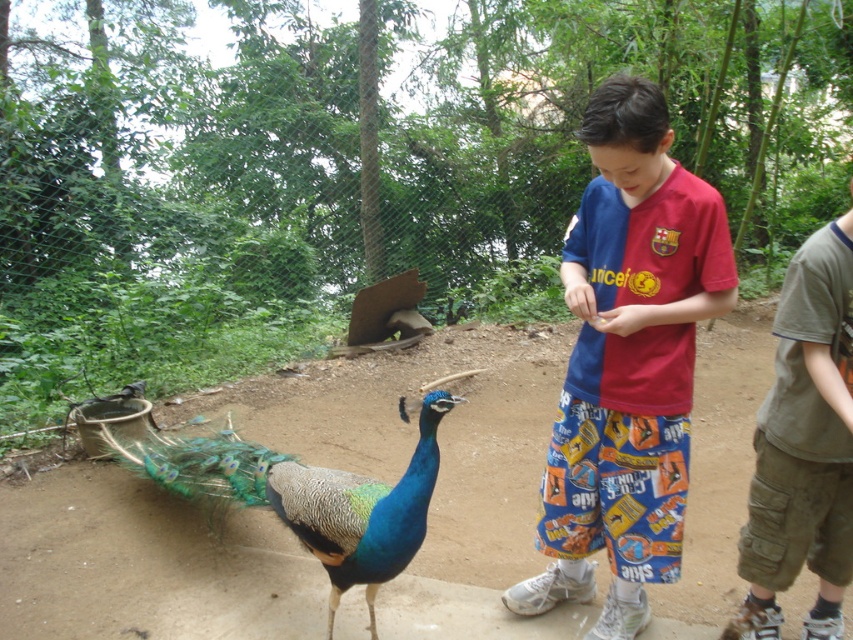
You are a zookeeper observing the peacock in its enclosure. You notice the khaki cotton shorts at right and the blue iridescent feathers at center. Which object has a greater width?

The blue iridescent feathers at center have a greater width than the khaki cotton shorts at right because the khaki cotton shorts at right is thinner than blue iridescent feathers at center.

You are standing at the point labeled as point (660, 564) in the image. The peacock is approaching a young boy on a dirt path. If the peacock starts moving towards the boy at a speed of 3 feet per second, how many seconds will it take for the peacock to reach the boy?

The distance between the point labeled as point (660, 564) and the viewer is 7.83 feet. Since the peacock is moving at 3 feet per second, it would take 7.83 divided by 3, which is approximately 2.61 seconds for the peacock to reach the boy.